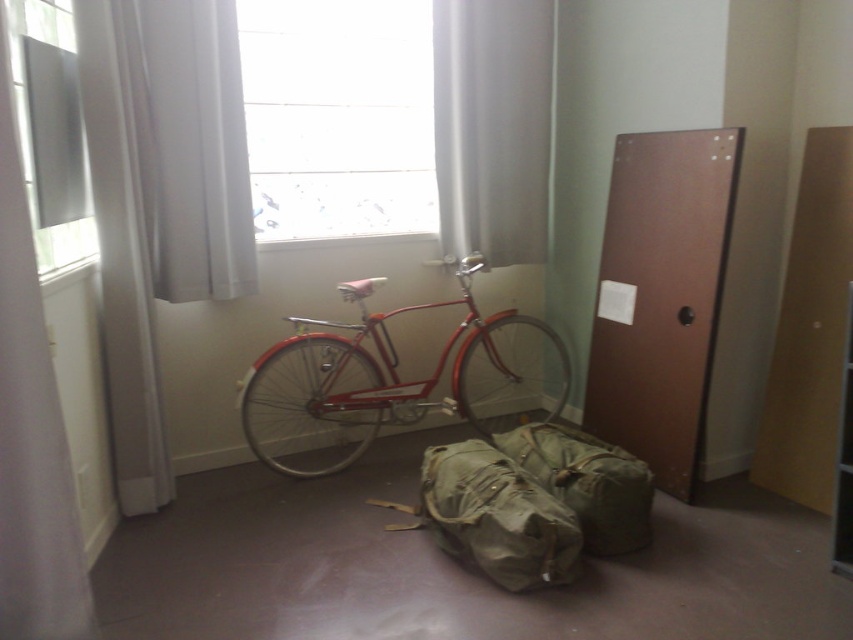
Question: Where is transparent glass window at upper center located in relation to white sheer curtain at left in the image?

Choices:
 (A) right
 (B) left

Answer: (A)

Question: Which point is closer to the camera taking this photo?

Choices:
 (A) (578, 452)
 (B) (556, 548)
 (C) (16, 26)
 (D) (426, 76)

Answer: (C)

Question: Which point is farther to the camera?

Choices:
 (A) (444, 234)
 (B) (490, 528)

Answer: (A)

Question: Can you confirm if shiny red bicycle at center is bigger than olive green canvas duffel bag at center?

Choices:
 (A) yes
 (B) no

Answer: (A)

Question: Which object is farther from the camera taking this photo?

Choices:
 (A) camouflage fabric duffel bag at center
 (B) olive green canvas duffel bag at center

Answer: (A)

Question: Does white sheer curtain at upper left have a lesser width compared to white sheer curtain at left?

Choices:
 (A) no
 (B) yes

Answer: (A)